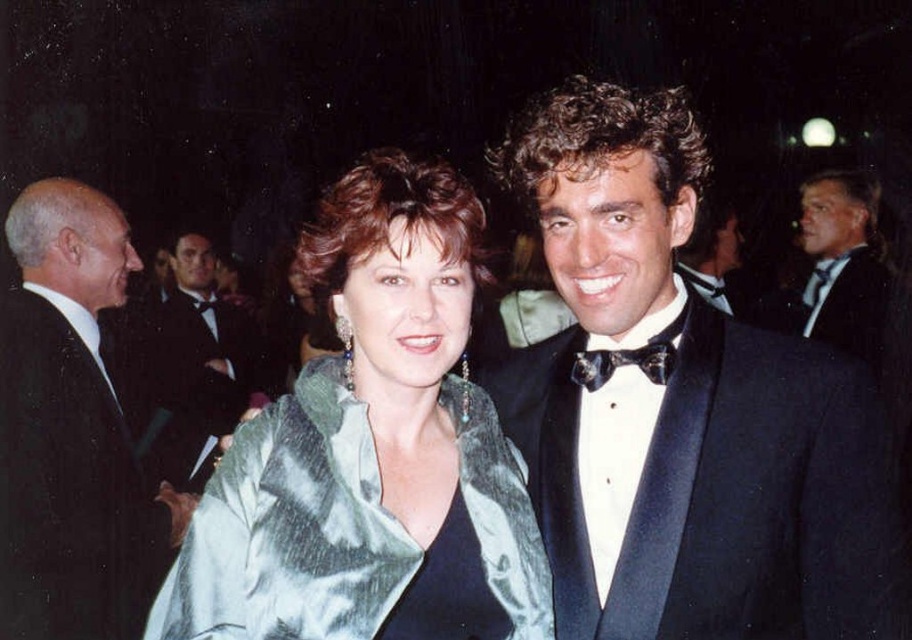
Question: Based on their relative distances, which object is farther from the black satin bow tie at center?

Choices:
 (A) shiny black tuxedo at center
 (B) satin green coat at center

Answer: (A)

Question: Can you confirm if shiny black tuxedo at center is bigger than black satin bow tie at center?

Choices:
 (A) no
 (B) yes

Answer: (B)

Question: Which point is closer to the camera taking this photo?

Choices:
 (A) (219, 406)
 (B) (604, 380)
 (C) (361, 572)
 (D) (582, 284)

Answer: (C)

Question: Can you confirm if black satin tuxedo at center is smaller than shiny black tuxedo at center?

Choices:
 (A) no
 (B) yes

Answer: (B)

Question: Which of these objects is positioned farthest from the black satin tuxedo at center?

Choices:
 (A) satin green coat at center
 (B) shiny black tuxedo at center

Answer: (B)

Question: Is satin green coat at center below black satin suit at left?

Choices:
 (A) yes
 (B) no

Answer: (B)